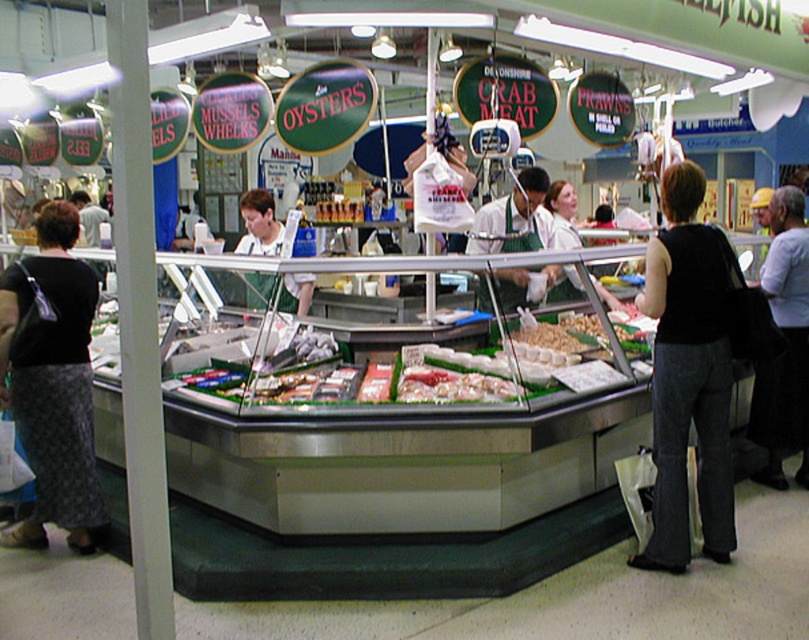
Question: Among these objects, which one is farthest from the camera?

Choices:
 (A) white apron at center
 (B) black fabric pants at lower right
 (C) shiny plastic seafood at center

Answer: (A)

Question: Which object is farther from the camera taking this photo?

Choices:
 (A) white apron at center
 (B) black fabric pants at lower right
 (C) black textured skirt at lower left
 (D) black fabric at right

Answer: (D)

Question: Is shiny plastic seafood at center to the left of black fabric at right from the viewer's perspective?

Choices:
 (A) yes
 (B) no

Answer: (A)

Question: Does black fabric pants at lower right have a greater width compared to white apron at center?

Choices:
 (A) yes
 (B) no

Answer: (B)

Question: From the image, what is the correct spatial relationship of black fabric pants at lower right in relation to white apron at center?

Choices:
 (A) below
 (B) above

Answer: (A)

Question: Which point appears closest to the camera in this image?

Choices:
 (A) pyautogui.click(x=479, y=225)
 (B) pyautogui.click(x=272, y=241)
 (C) pyautogui.click(x=91, y=385)
 (D) pyautogui.click(x=500, y=356)

Answer: (C)